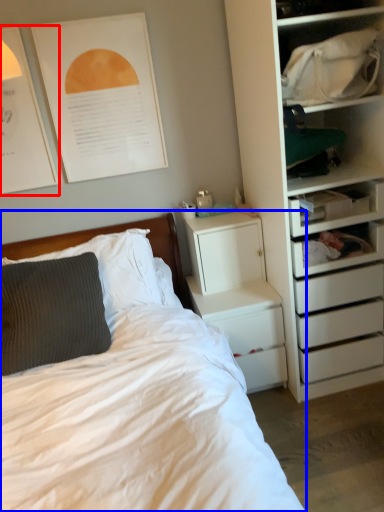
Question: Among these objects, which one is nearest to the camera, poster page (highlighted by a red box) or bed (highlighted by a blue box)?

Choices:
 (A) poster page
 (B) bed

Answer: (B)